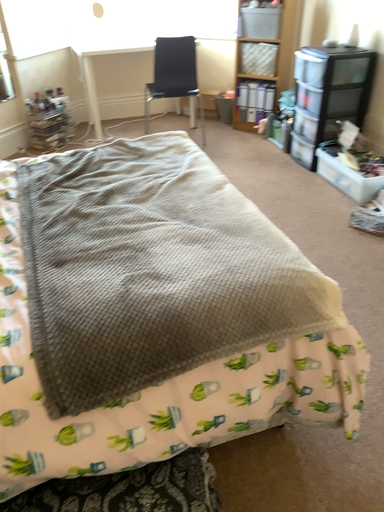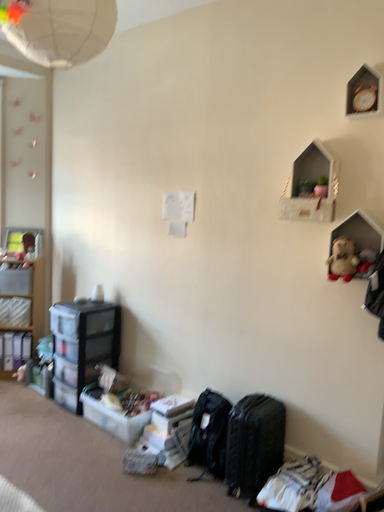
Question: How did the camera likely rotate when shooting the video?

Choices:
 (A) rotated downward
 (B) rotated upward

Answer: (B)